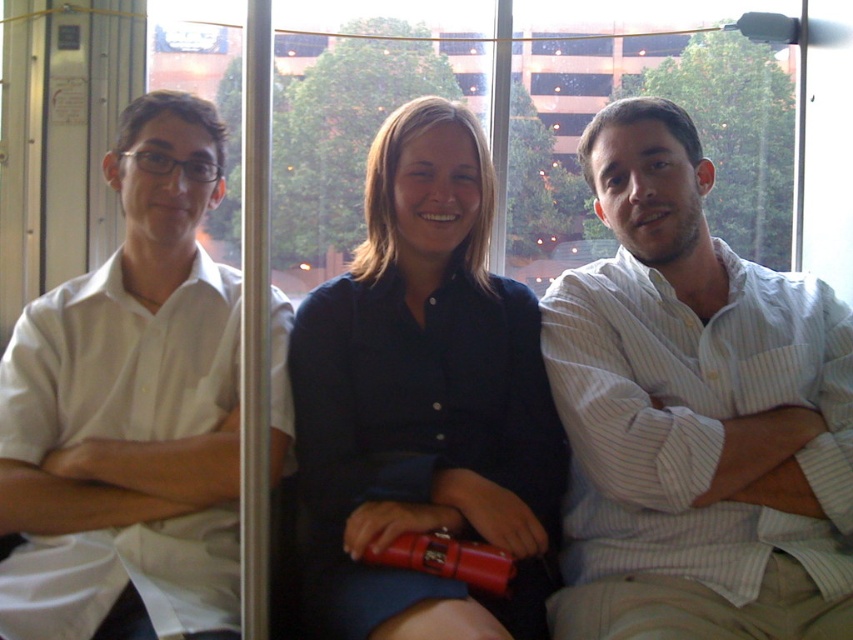
Who is more forward, (659, 394) or (115, 323)?

Point (659, 394)

Which is above, white striped shirt at center or white smooth shirt at left?

white smooth shirt at left is higher up.

Is point (695, 253) more distant than point (125, 584)?

Yes, it is behind point (125, 584).

The height and width of the screenshot is (640, 853). I want to click on white striped shirt at center, so click(694, 413).

Who is positioned more to the right, white striped shirt at center or dark blue shirt at center?

From the viewer's perspective, white striped shirt at center appears more on the right side.

The height and width of the screenshot is (640, 853). What are the coordinates of `white striped shirt at center` in the screenshot? It's located at (694, 413).

I want to click on white striped shirt at center, so click(694, 413).

This screenshot has height=640, width=853. In order to click on dark blue shirt at center in this screenshot , I will do `click(422, 400)`.

Which is behind, point (409, 316) or point (223, 394)?

Point (409, 316)

Locate an element on the screen. The width and height of the screenshot is (853, 640). dark blue shirt at center is located at coordinates (422, 400).